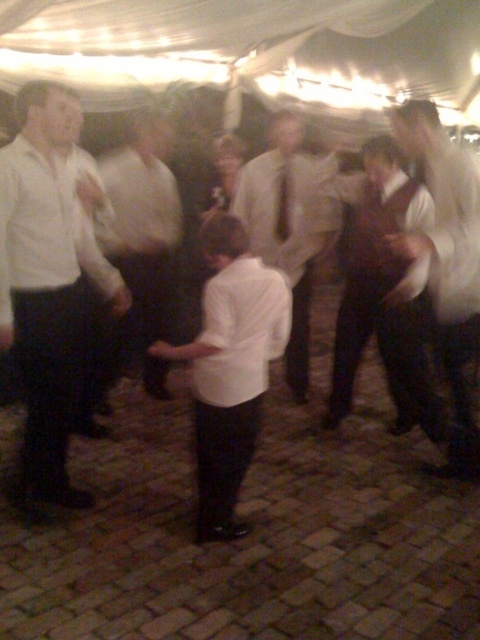
Question: Is light brown textured shirt at center to the left of matte white tie at center from the viewer's perspective?

Choices:
 (A) yes
 (B) no

Answer: (B)

Question: Is white shirt at right closer to the viewer compared to light brown textured shirt at center?

Choices:
 (A) yes
 (B) no

Answer: (A)

Question: Which point appears closest to the camera in this image?

Choices:
 (A) (459, 348)
 (B) (279, 202)

Answer: (A)

Question: Which is nearer to the white shirt at center?

Choices:
 (A) white matte shirt at left
 (B) white matte dress shirt at center
 (C) white shirt at right
 (D) matte white tie at center

Answer: (A)

Question: Is matte white shirt at left positioned before white shirt at center?

Choices:
 (A) no
 (B) yes

Answer: (B)

Question: Among these objects, which one is farthest from the camera?

Choices:
 (A) light brown textured shirt at center
 (B) white shirt at center
 (C) matte white shirt at left

Answer: (A)